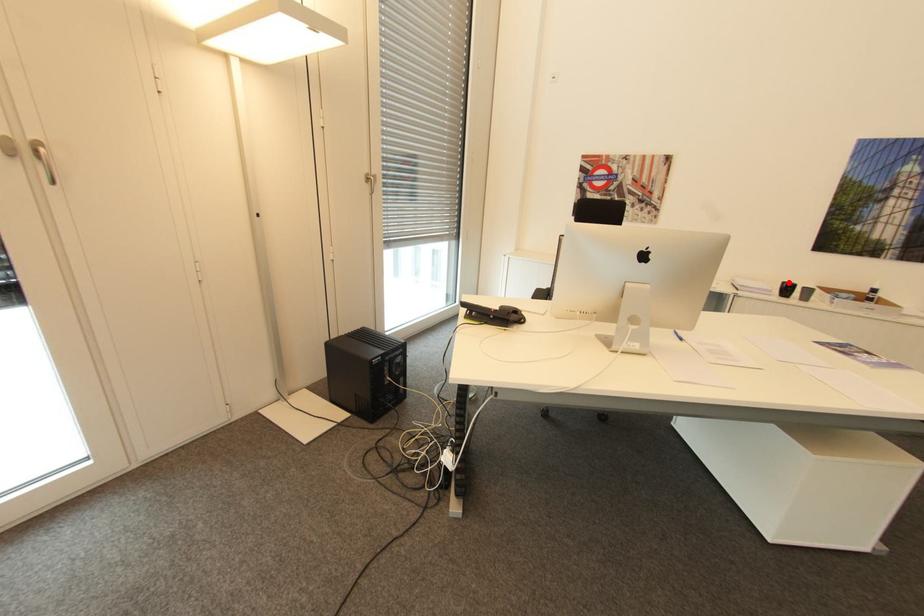
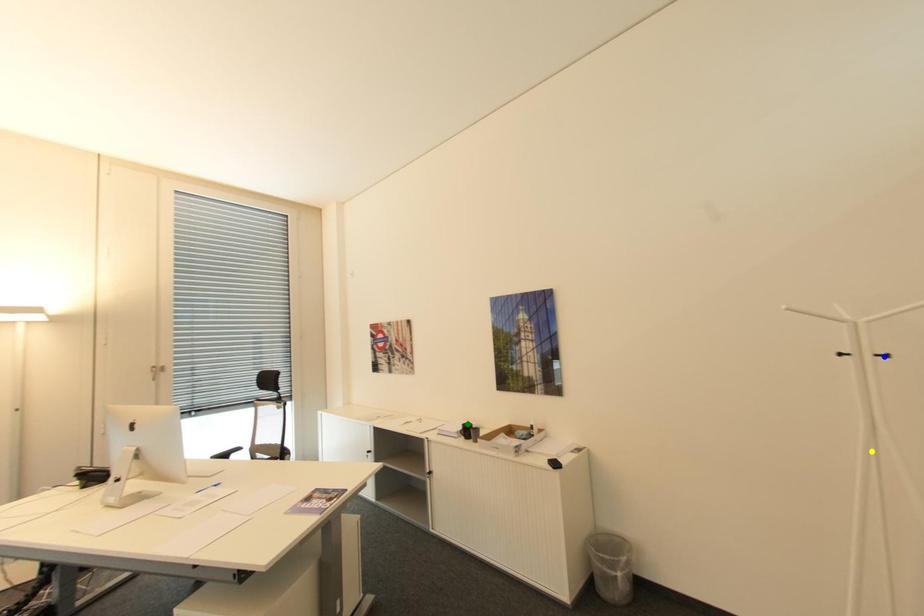
Question: I am providing you with two images of the same scene from different viewpoints. A red point is marked on the first image. You are given multiple points on the second image. Which point in image 2 is actually the same real-world point as the red point in image 1?

Choices:
 (A) yellow point
 (B) blue point
 (C) green point

Answer: (C)